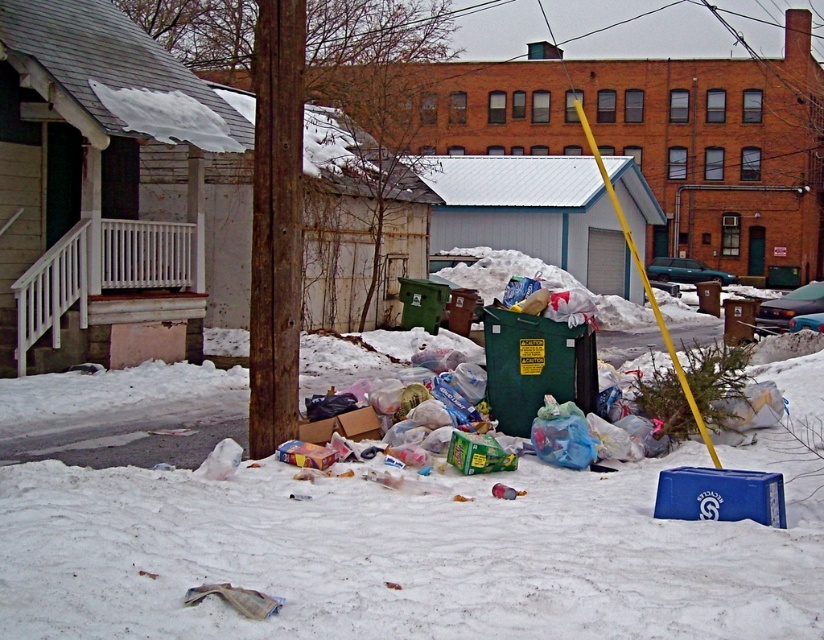
Question: Which of the following is the farthest from the observer?

Choices:
 (A) yellow plastic pole at center right
 (B) white fluffy snow at lower center

Answer: (A)

Question: Where is white fluffy snow at lower center located in relation to yellow plastic pole at center right in the image?

Choices:
 (A) above
 (B) below

Answer: (B)

Question: Which of the following is the farthest from the observer?

Choices:
 (A) (705, 442)
 (B) (620, 625)
 (C) (297, 321)

Answer: (C)

Question: Is white fluffy snow at lower center thinner than yellow plastic pole at center right?

Choices:
 (A) no
 (B) yes

Answer: (B)

Question: Which of the following is the closest to the observer?

Choices:
 (A) white fluffy snow at lower center
 (B) rusty wood pole at center

Answer: (A)

Question: Is white fluffy snow at lower center smaller than rusty wood pole at center?

Choices:
 (A) no
 (B) yes

Answer: (B)